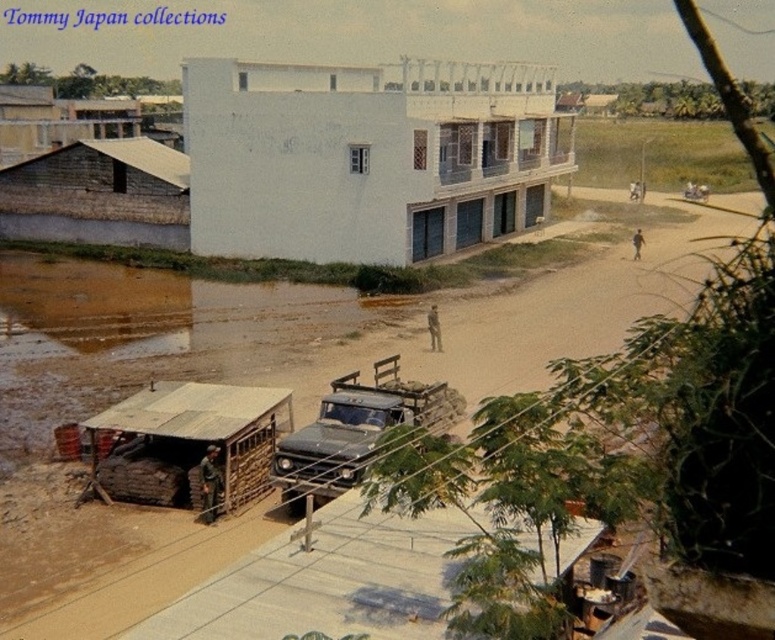
You are a delivery truck driver who needs to reach the front entrance of the large white building. You are currently positioned on the brown dirt track at center. Based on the coordinates provided, can you determine the direction you should drive to reach the building?

The brown dirt track at center is located at coordinates point (418, 323). Since the dirt track runs parallel to the building, you should drive along the dirt track towards the building to reach the front entrance.

You are a driver trying to navigate through the brown dirt track at center and the rusty metal jeep at center. Which object is positioned higher in the image?

The brown dirt track at center is located above the rusty metal jeep at center, so it is positioned higher in the image.

From the picture: You are a driver navigating a muddy road near the white smooth building at center and the rusty metal jeep at center. Which object is higher in elevation?

The white smooth building at center is located above the rusty metal jeep at center, so it has a higher elevation.